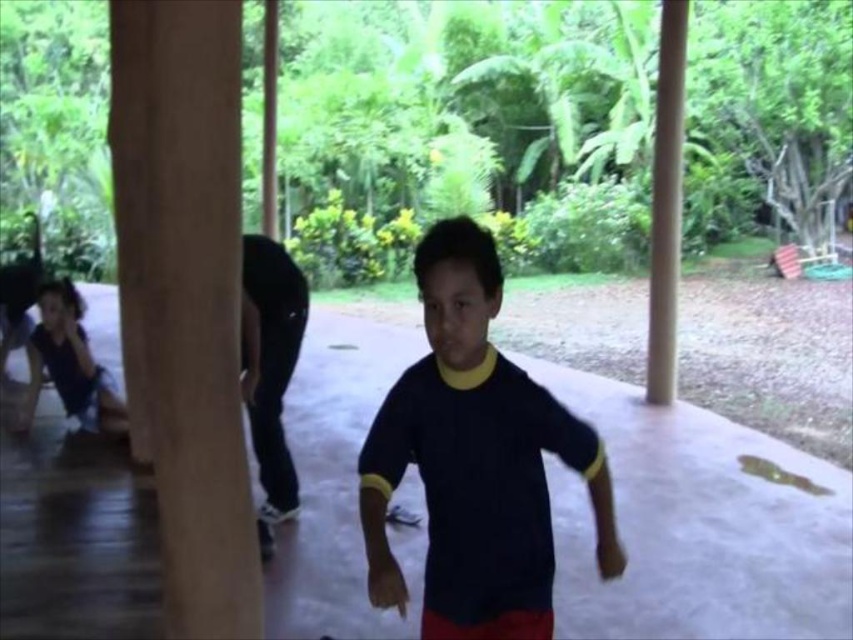
Which is above, black matte pants at center or matte black shirt at left?

matte black shirt at left is higher up.

Can you confirm if black matte pants at center is thinner than matte black shirt at left?

Yes, black matte pants at center is thinner than matte black shirt at left.

Does point (247, 336) come behind point (73, 337)?

No.

Locate an element on the screen. Image resolution: width=853 pixels, height=640 pixels. black matte pants at center is located at coordinates (270, 362).

Which is below, brown wood pillar at left or matte black shirt at left?

matte black shirt at left is lower down.

Can you confirm if brown wood pillar at left is wider than matte black shirt at left?

No.

Does point (165, 65) lie behind point (61, 371)?

No, it is not.

The height and width of the screenshot is (640, 853). Identify the location of brown wood pillar at left. (184, 298).

Between dark blue jersey at center and matte black shirt at left, which one appears on the left side from the viewer's perspective?

matte black shirt at left is more to the left.

Between dark blue jersey at center and matte black shirt at left, which one has less height?

dark blue jersey at center

Where is `dark blue jersey at center`? The height and width of the screenshot is (640, 853). dark blue jersey at center is located at coordinates (474, 460).

Locate an element on the screen. This screenshot has width=853, height=640. dark blue jersey at center is located at coordinates (474, 460).